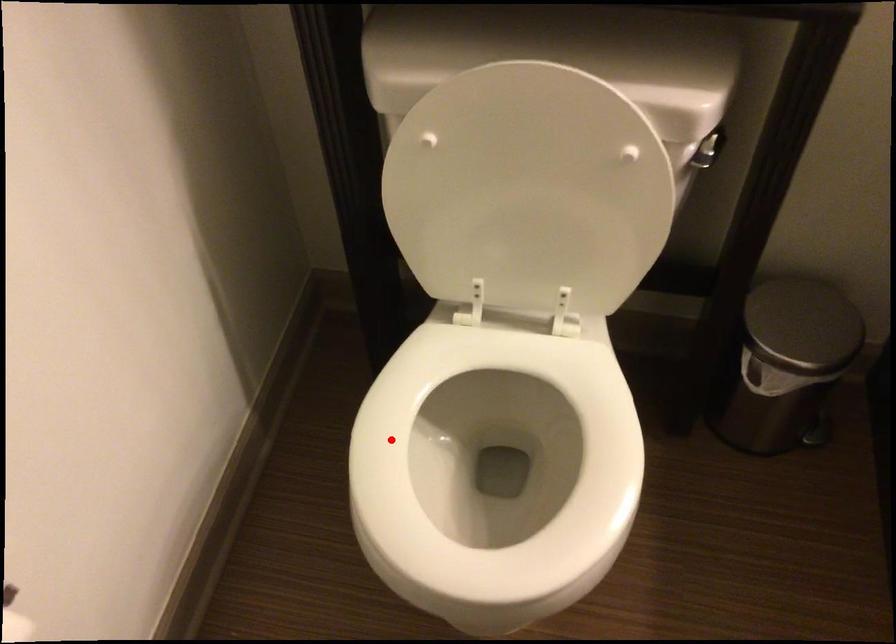
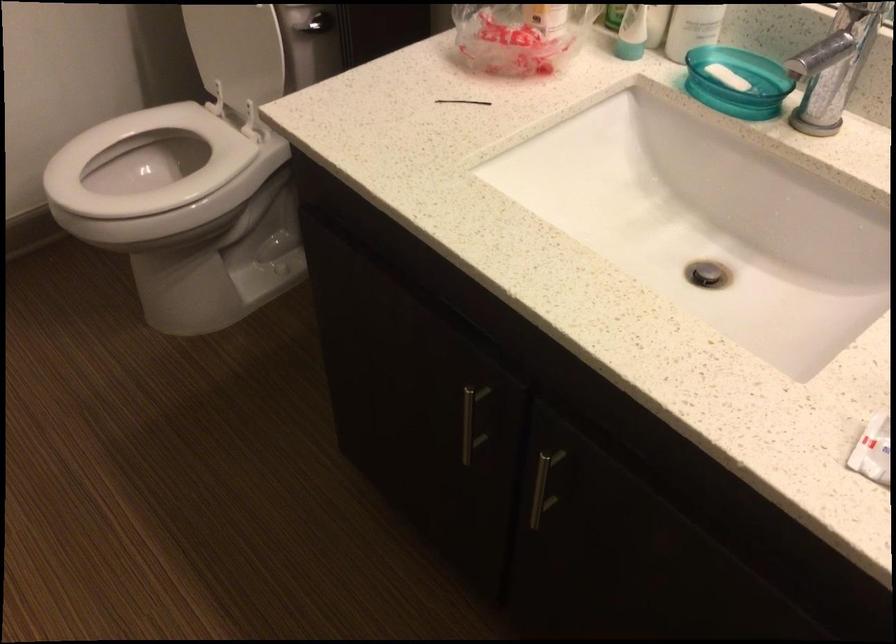
Find the pixel in the second image that matches the highlighted location in the first image.

(144, 163)